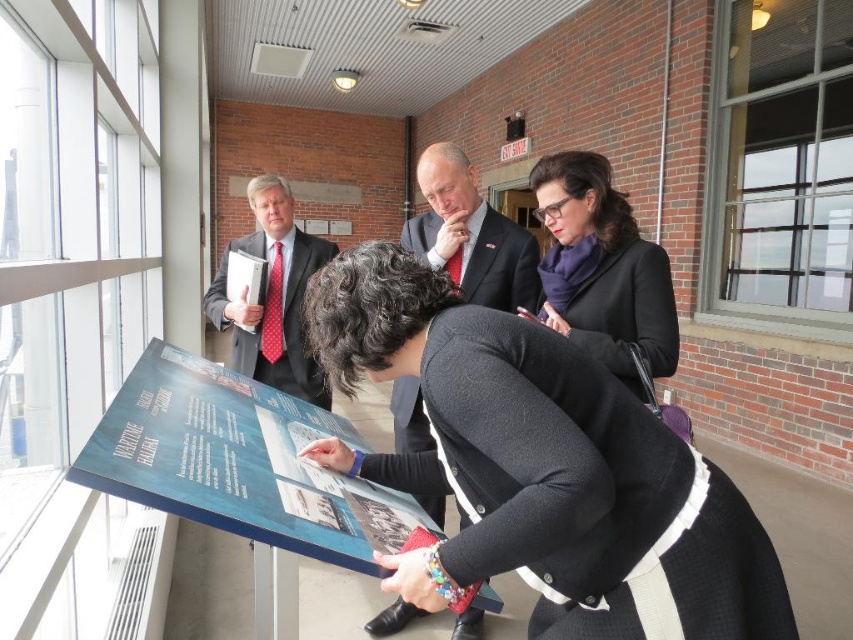
You are a tailor measuring garments for alterations. You have a black wool coat at center and a matte black suit at left. Which garment requires a longer vertical alteration to reach the same height?

The black wool coat at center is not as tall as the matte black suit at left, so the black wool coat at center requires a longer vertical alteration to match the height of the matte black suit at left.

In the scene shown: You are a security guard who needs to identify the exact location of two people in the scene. The first person is wearing a black wool coat at center, and the second is wearing a matte black suit at left. According to the scene description, which clothing item is located to the right of the other?

The black wool coat at center is positioned on the right side of the matte black suit at left.